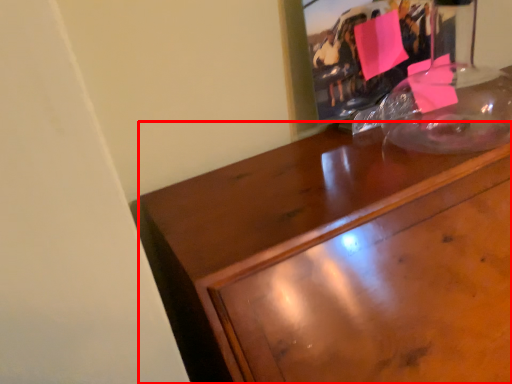
Question: From the image's perspective, where is desk (annotated by the red box) located relative to picture frame?

Choices:
 (A) below
 (B) above

Answer: (A)